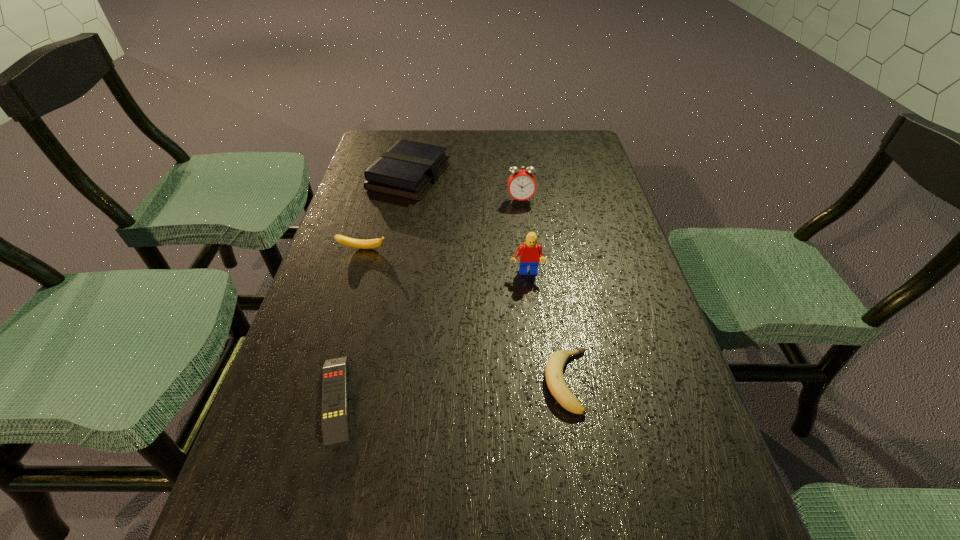
The height and width of the screenshot is (540, 960). I want to click on vacant point located 0.100m on the front of the third tallest object, so click(x=398, y=224).

Find the location of a particular element. vacant space located 0.160m at the stem of the farther banana is located at coordinates (348, 300).

Locate an element on the screen. free space located on the left of the nearer banana is located at coordinates (399, 381).

Where is `free spot located on the right of the remote control`? free spot located on the right of the remote control is located at coordinates (552, 397).

Locate an element on the screen. Image resolution: width=960 pixels, height=540 pixels. object that is at the far edge is located at coordinates (408, 169).

Image resolution: width=960 pixels, height=540 pixels. I want to click on book at the left edge, so click(x=408, y=169).

In order to click on banana present at the left edge in this screenshot , I will do `click(355, 243)`.

Where is `remote control positioned at the left edge`? The width and height of the screenshot is (960, 540). remote control positioned at the left edge is located at coordinates (x=334, y=418).

Locate an element on the screen. This screenshot has height=540, width=960. object that is at the far left corner is located at coordinates (408, 169).

Where is `blank space at the far edge of the desktop`? blank space at the far edge of the desktop is located at coordinates (544, 145).